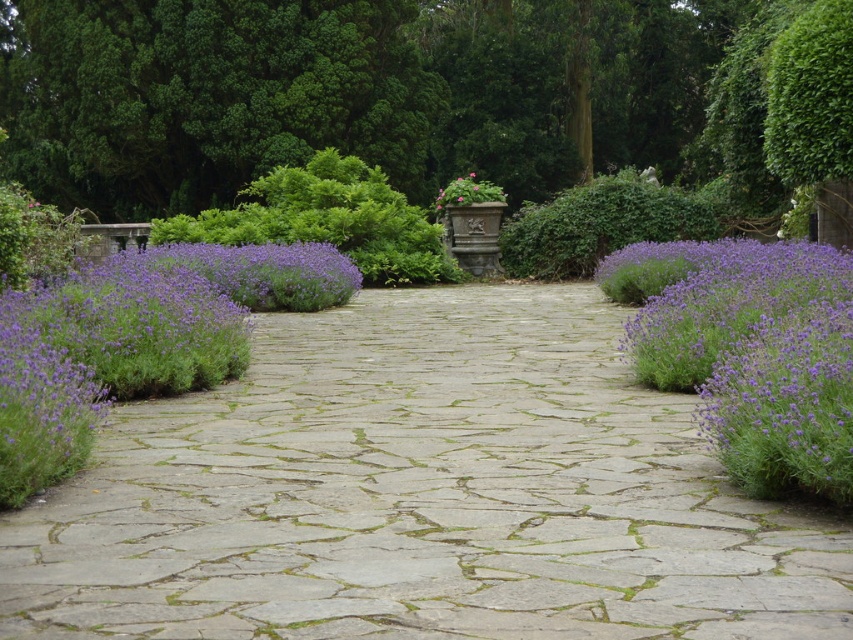
Question: Which point is closer to the camera?

Choices:
 (A) (722, 394)
 (B) (534, 628)
 (C) (479, 188)

Answer: (B)

Question: Which object appears closest to the camera in this image?

Choices:
 (A) purple soft lavender at right
 (B) pink matte flower pot at center
 (C) natural stone path at center

Answer: (C)

Question: Which point is closer to the camera taking this photo?

Choices:
 (A) (436, 396)
 (B) (743, 394)

Answer: (B)

Question: Does purple soft lavender at right have a lesser width compared to pink matte flower pot at center?

Choices:
 (A) no
 (B) yes

Answer: (A)

Question: Does natural stone path at center have a larger size compared to pink matte flower pot at center?

Choices:
 (A) yes
 (B) no

Answer: (B)

Question: Does purple soft lavender at right appear on the right side of pink matte flower pot at center?

Choices:
 (A) no
 (B) yes

Answer: (B)